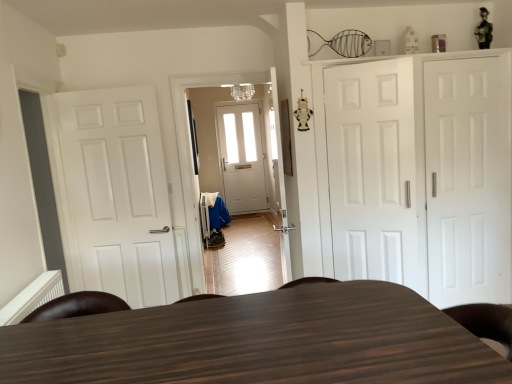
Question: Is white matte door at left, acting as the first door starting from the left, not near white matte door at center, arranged as the 2th door when viewed from the right?

Choices:
 (A) no
 (B) yes

Answer: (B)

Question: Is white matte door at left, acting as the first door starting from the left, thinner than white matte door at center, placed as the 2th door when sorted from left to right?

Choices:
 (A) no
 (B) yes

Answer: (A)

Question: From the image's perspective, would you say white matte door at left, which is counted as the 3th door, starting from the right, is shown under white matte door at center, arranged as the 2th door when viewed from the right?

Choices:
 (A) yes
 (B) no

Answer: (A)

Question: Is white matte door at left, acting as the first door starting from the left, shorter than white matte door at center, placed as the 2th door when sorted from left to right?

Choices:
 (A) no
 (B) yes

Answer: (A)

Question: Does white matte door at left, acting as the first door starting from the left, appear on the left side of white matte door at center, placed as the 2th door when sorted from left to right?

Choices:
 (A) no
 (B) yes

Answer: (B)

Question: Visually, is white matte door at left, acting as the first door starting from the left, positioned to the left or to the right of white matte door at center, arranged as the 2th door when viewed from the right?

Choices:
 (A) right
 (B) left

Answer: (B)

Question: Is point (101, 142) closer or farther from the camera than point (318, 162)?

Choices:
 (A) farther
 (B) closer

Answer: (A)

Question: From a real-world perspective, is white matte door at left, acting as the first door starting from the left, above or below white matte door at center, placed as the 2th door when sorted from left to right?

Choices:
 (A) above
 (B) below

Answer: (B)

Question: Considering the positions of white matte door at left, acting as the first door starting from the left, and white matte door at center, placed as the 2th door when sorted from left to right, in the image, is white matte door at left, acting as the first door starting from the left, taller or shorter than white matte door at center, placed as the 2th door when sorted from left to right,?

Choices:
 (A) short
 (B) tall

Answer: (B)

Question: Relative to white matte door at left, which is counted as the 3th door, starting from the right, is white matte cabinet at right in front or behind?

Choices:
 (A) front
 (B) behind

Answer: (A)

Question: Is point (489, 77) closer or farther from the camera than point (93, 221)?

Choices:
 (A) farther
 (B) closer

Answer: (B)

Question: In terms of height, does white matte cabinet at right look taller or shorter compared to white matte door at left, acting as the first door starting from the left?

Choices:
 (A) short
 (B) tall

Answer: (B)

Question: From the image's perspective, relative to white matte door at left, which is counted as the 3th door, starting from the right, is white matte cabinet at right above or below?

Choices:
 (A) below
 (B) above

Answer: (B)

Question: From the image's perspective, relative to white matte door at right, the 1th door viewed from the right, is white matte cabinet at right above or below?

Choices:
 (A) above
 (B) below

Answer: (A)

Question: From a real-world perspective, is white matte cabinet at right positioned above or below white matte door at right, arranged as the 3th door when viewed from the left?

Choices:
 (A) above
 (B) below

Answer: (A)